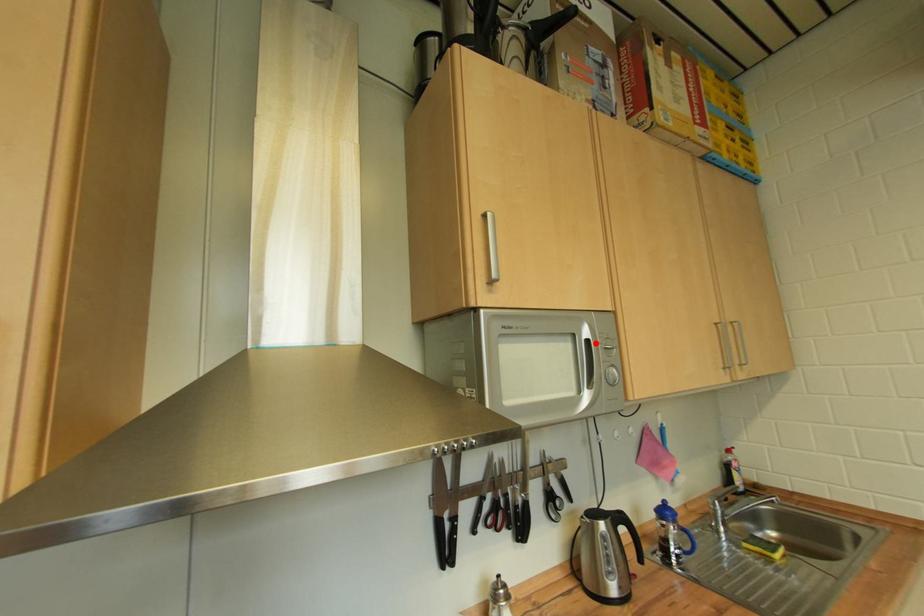
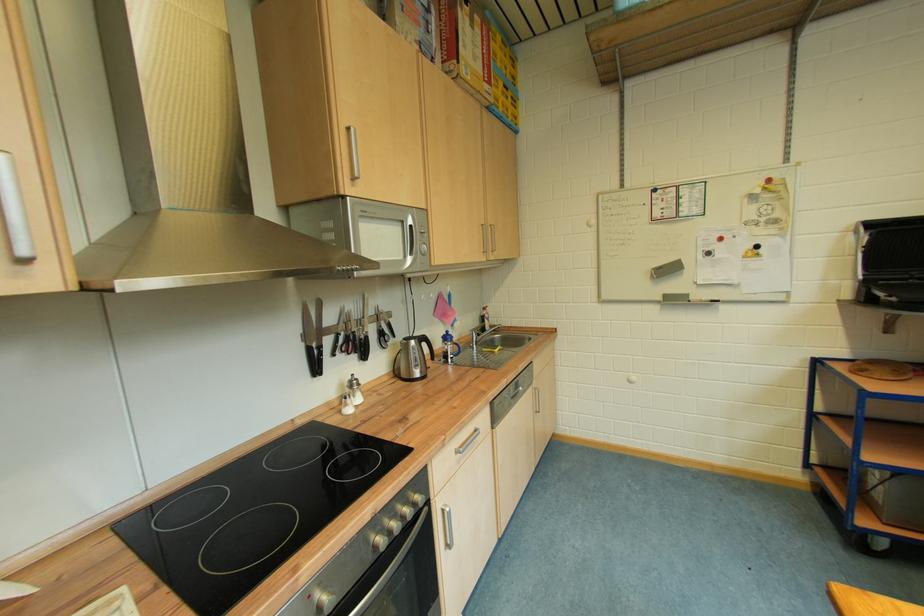
Locate, in the second image, the point that corresponds to the highlighted location in the first image.

(419, 229)